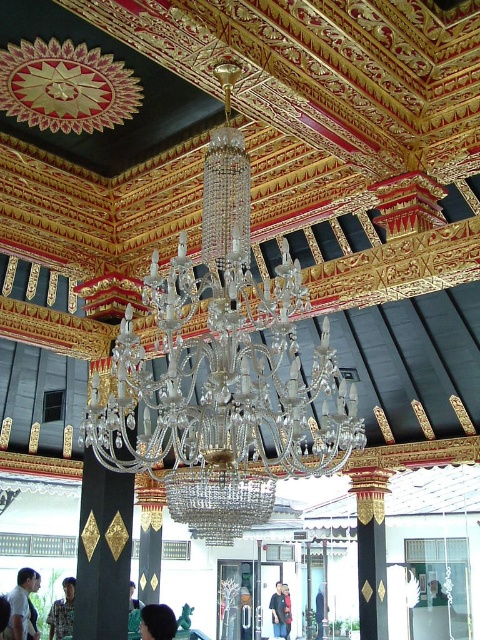
Question: Estimate the real-world distances between objects in this image. Which object is farther from the camouflage uniform at lower left?

Choices:
 (A) dark blue shirt at center
 (B) clear crystal chandelier at center
 (C) white fabric shirt at lower left
 (D) green fabric person at lower center

Answer: (A)

Question: Considering the relative positions of white fabric shirt at lower left and camouflage uniform at lower left in the image provided, where is white fabric shirt at lower left located with respect to camouflage uniform at lower left?

Choices:
 (A) above
 (B) below

Answer: (A)

Question: Which of these objects is positioned farthest from the blue velvet dress at center?

Choices:
 (A) black fabric person at center
 (B) dark brown hair at center

Answer: (B)

Question: Can you confirm if black fabric person at center is wider than dark blue shirt at center?

Choices:
 (A) no
 (B) yes

Answer: (B)

Question: Which of the following is the closest to the observer?

Choices:
 (A) clear crystal chandelier at center
 (B) white fabric shirt at lower left

Answer: (A)

Question: Considering the relative positions of camouflage uniform at lower left and green fabric person at lower center in the image provided, where is camouflage uniform at lower left located with respect to green fabric person at lower center?

Choices:
 (A) right
 (B) left

Answer: (B)